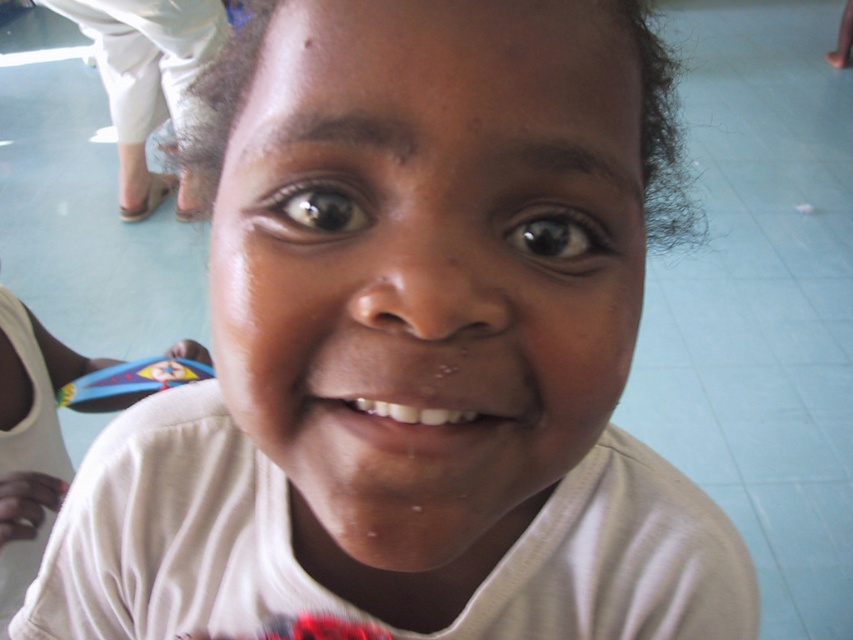
You are a photographer trying to capture a candid shot of the child in the scene. You notice a white cotton pants at upper left located at point (148, 83). To avoid the pants from being in the shot, should you adjust your camera angle upwards or downwards?

The white cotton pants at upper left is located at point (148, 83) which is at the upper left of the image. To avoid it from being in the shot, you should adjust your camera angle downwards.

You are a photographer setting up for a group photo. You need to ensure that both the white cotton pants at upper left and the white glossy teeth at center are in focus. Given that your camera has a depth of field that can sharply focus on objects within a 2.5 meter range, will both subjects be in focus?

The white cotton pants at upper left is 2.89 meters from white glossy teeth at center. Since the distance between them exceeds the 2.5 meter depth of field range, not both can be in focus simultaneously.

Looking at the image of the child, which object is larger between the smooth skin face at center and the black glossy eye at center?

The smooth skin face at center is bigger than the black glossy eye at center.